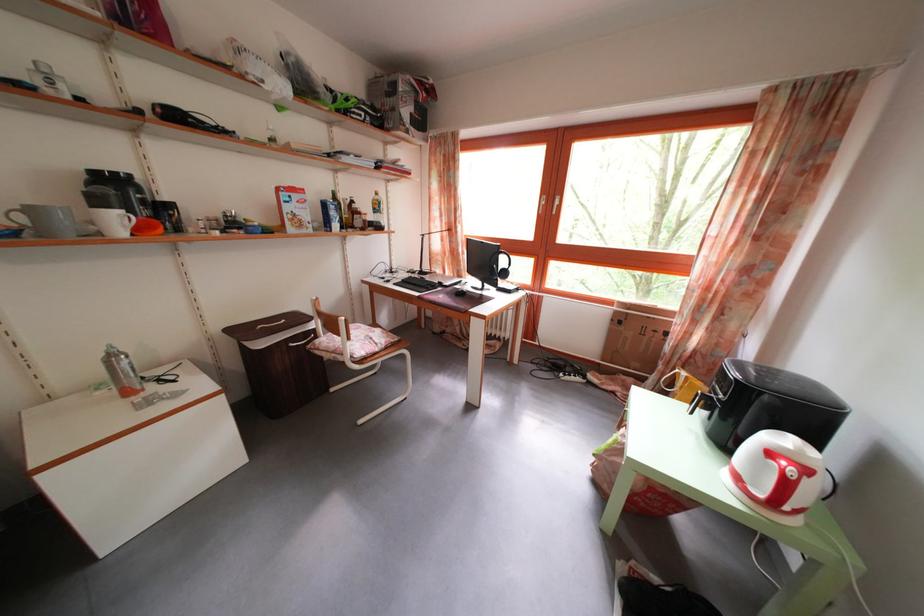
Find the location of a particular element. The width and height of the screenshot is (924, 616). chair sitting surface is located at coordinates (358, 350).